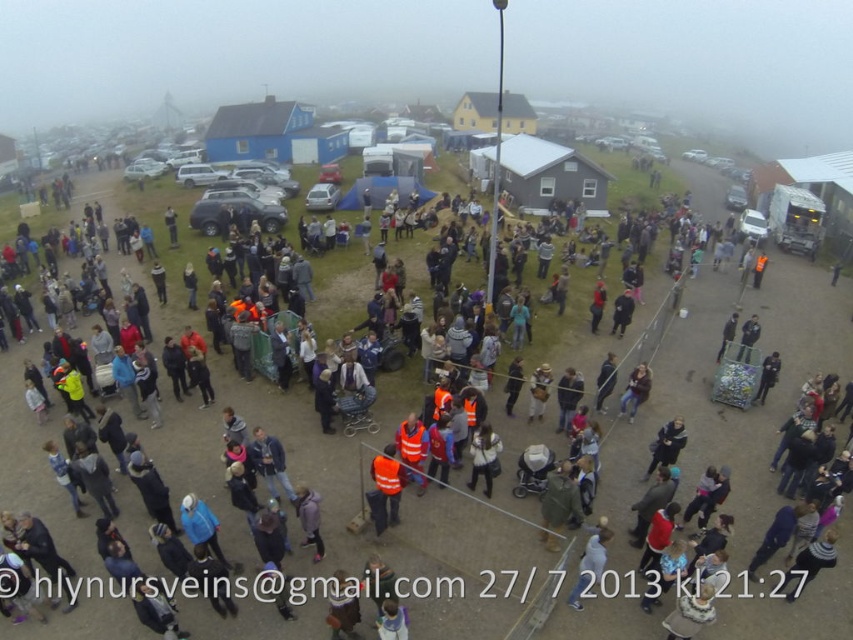
Question: Which of the following is the closest to the observer?

Choices:
 (A) leather jacket at center
 (B) white fabric jacket at center

Answer: (B)

Question: Can you confirm if white fabric jacket at lower center is smaller than leather jacket at center?

Choices:
 (A) no
 (B) yes

Answer: (A)

Question: Which of these objects is positioned closest to the white fabric jacket at lower center?

Choices:
 (A) white fabric jacket at center
 (B) leather jacket at center

Answer: (A)

Question: Estimate the real-world distances between objects in this image. Which object is closer to the white fabric jacket at center?

Choices:
 (A) leather jacket at center
 (B) white fabric jacket at lower center

Answer: (B)

Question: Does white fabric jacket at lower center have a smaller size compared to white fabric jacket at center?

Choices:
 (A) no
 (B) yes

Answer: (B)

Question: Is white fabric jacket at lower center thinner than white fabric jacket at center?

Choices:
 (A) no
 (B) yes

Answer: (A)